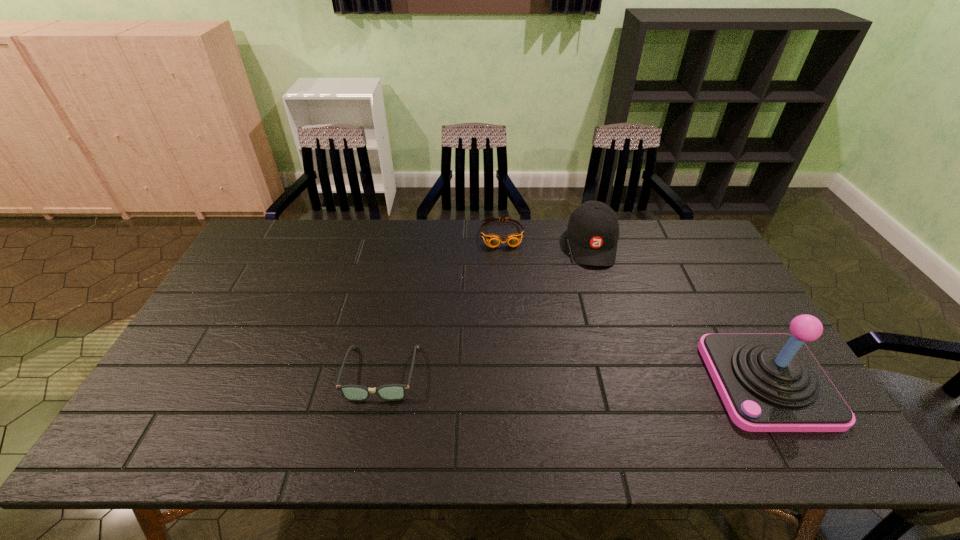
Locate an element on the screen. The image size is (960, 540). vacant area between the shortest object and the rightmost object is located at coordinates (635, 308).

This screenshot has height=540, width=960. I want to click on vacant area that lies between the second object from right to left and the shortest object, so click(547, 239).

Where is `free area in between the second tallest object and the third object from right to left`? free area in between the second tallest object and the third object from right to left is located at coordinates (547, 239).

You are a GUI agent. You are given a task and a screenshot of the screen. Output one action in this format:
    pyautogui.click(x=<x>, y=<y>)
    Task: Click on the empty space between the shortest object and the spectacles
    The height and width of the screenshot is (540, 960).
    Given the screenshot: What is the action you would take?
    pyautogui.click(x=442, y=304)

The width and height of the screenshot is (960, 540). Find the location of `empty location between the spectacles and the third shortest object`. empty location between the spectacles and the third shortest object is located at coordinates (487, 309).

What are the coordinates of `vacant area between the baseball cap and the second shortest object` in the screenshot? It's located at (487, 309).

I want to click on vacant space that is in between the spectacles and the second object from left to right, so click(442, 304).

Where is `free space between the goggles and the second shortest object`? The height and width of the screenshot is (540, 960). free space between the goggles and the second shortest object is located at coordinates (442, 304).

The height and width of the screenshot is (540, 960). In order to click on free point between the goggles and the third object from left to right in this screenshot , I will do `click(547, 239)`.

Choose which object is the nearest neighbor to the leftmost object. Please provide its 2D coordinates. Your answer should be formatted as a tuple, i.e. [(x, y)], where the tuple contains the x and y coordinates of a point satisfying the conditions above.

[(493, 240)]